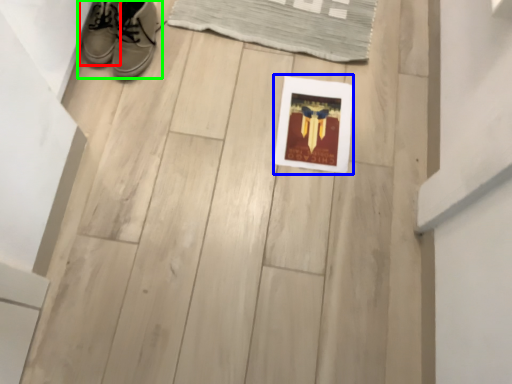
Question: Estimate the real-world distances between objects in this image. Which object is farther from footwear (highlighted by a red box), picture frame (highlighted by a blue box) or footwear (highlighted by a green box)?

Choices:
 (A) picture frame
 (B) footwear

Answer: (A)